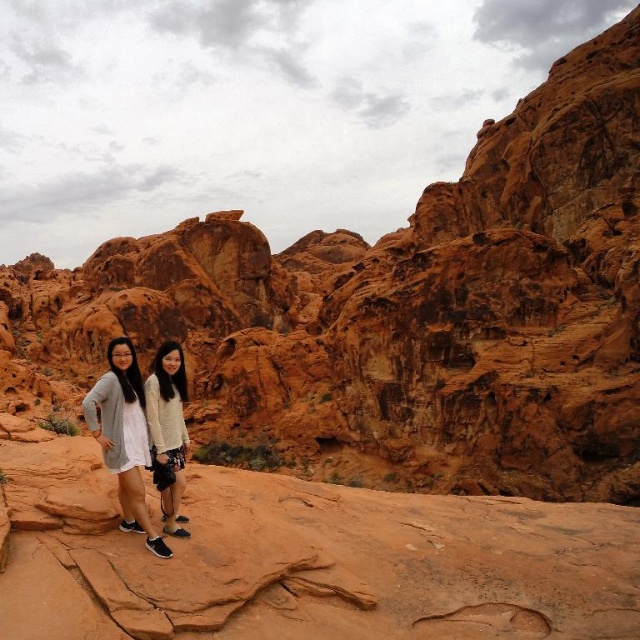
Question: Can you confirm if matte gray sweater at lower left is bigger than white fuzzy sweater at center?

Choices:
 (A) yes
 (B) no

Answer: (A)

Question: Does matte gray sweater at lower left have a smaller size compared to white fuzzy sweater at center?

Choices:
 (A) yes
 (B) no

Answer: (B)

Question: Among these objects, which one is nearest to the camera?

Choices:
 (A) matte gray sweater at lower left
 (B) white fuzzy sweater at center

Answer: (A)

Question: Which object is farther from the camera taking this photo?

Choices:
 (A) white fuzzy sweater at center
 (B) matte gray sweater at lower left

Answer: (A)

Question: Does matte gray sweater at lower left come behind white fuzzy sweater at center?

Choices:
 (A) yes
 (B) no

Answer: (B)